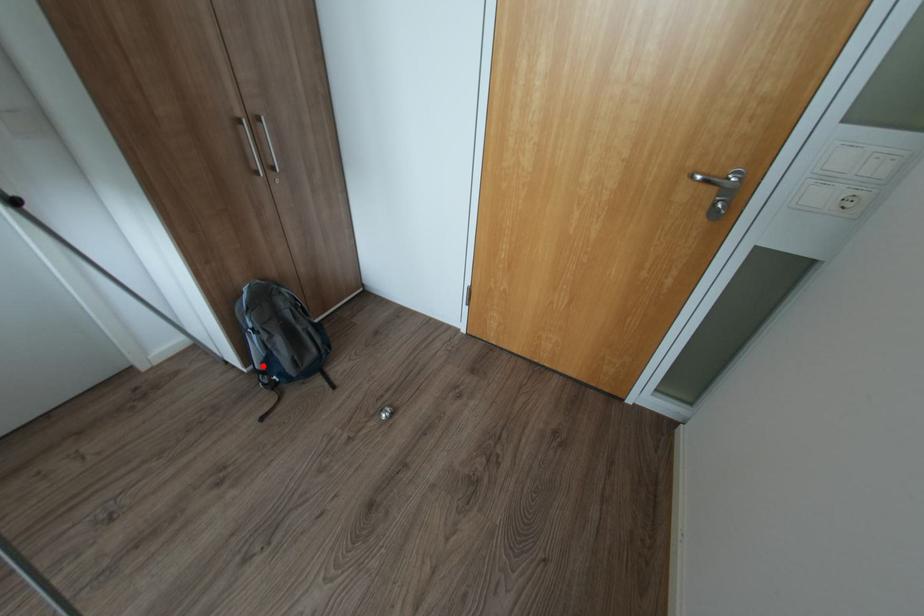
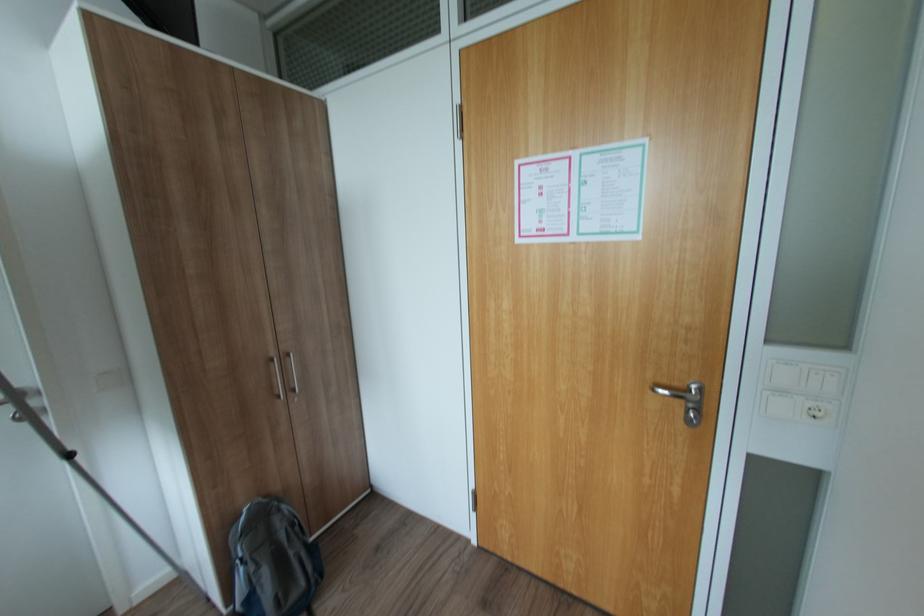
Find the pixel in the second image that matches the highlighted location in the first image.

(244, 608)